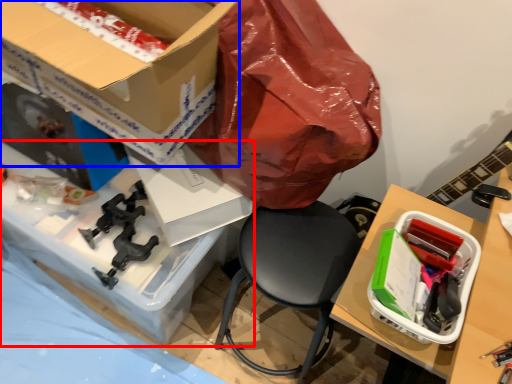
Question: Which point is closer to the camera, desk (highlighted by a red box) or box (highlighted by a blue box)?

Choices:
 (A) desk
 (B) box

Answer: (B)